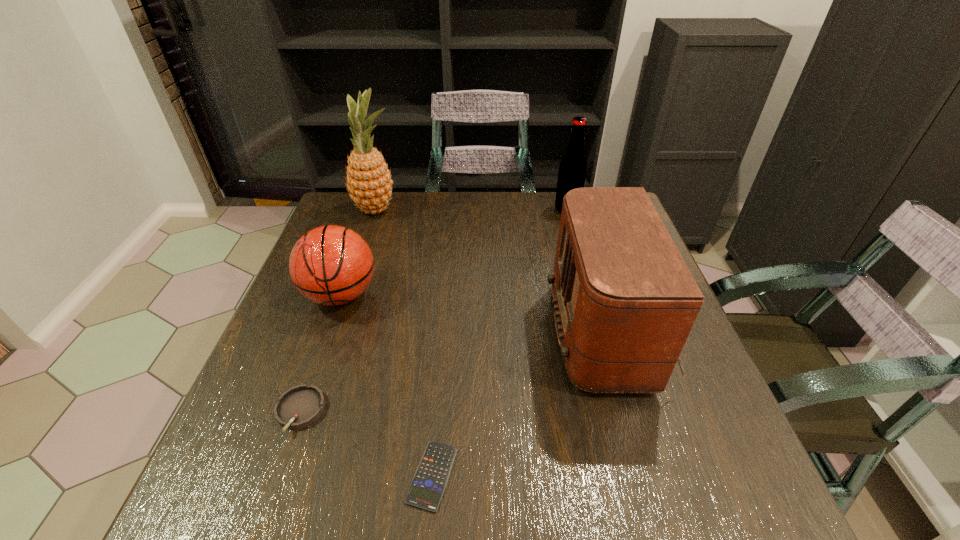
I want to click on blank space located 0.270m on the front panel of the radio receiver, so click(427, 333).

Find the location of a particular element. This screenshot has height=540, width=960. vacant space located 0.160m on the front panel of the radio receiver is located at coordinates (477, 333).

Identify the location of vacant space located 0.240m on the side with spill of the third shortest object. (298, 418).

I want to click on vacant region located 0.140m on the right of the ashtray, so click(398, 412).

Locate an element on the screen. The height and width of the screenshot is (540, 960). blank area located on the left of the fourth object from left to right is located at coordinates (378, 476).

At what (x,y) coordinates should I click in order to perform the action: click on pineapple that is at the far edge. Please return your answer as a coordinate pair (x, y). The height and width of the screenshot is (540, 960). Looking at the image, I should click on (369, 181).

In order to click on beer bottle located at the far edge in this screenshot , I will do `click(572, 169)`.

The width and height of the screenshot is (960, 540). Find the location of `object present at the near edge`. object present at the near edge is located at coordinates (429, 482).

Find the location of a particular element. This screenshot has height=540, width=960. pineapple that is at the left edge is located at coordinates (369, 181).

In order to click on basketball at the left edge in this screenshot , I will do `click(331, 265)`.